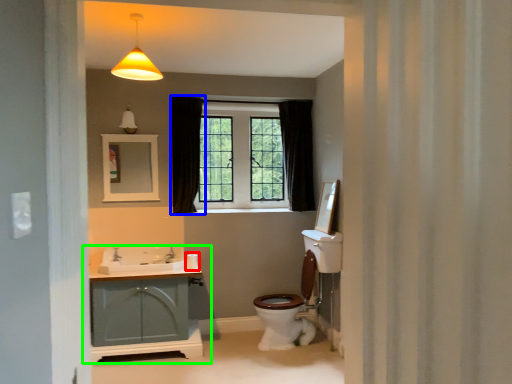
Question: Which object is the farthest from toilet paper (highlighted by a red box)? Choose among these: curtain (highlighted by a blue box) or bathroom cabinet (highlighted by a green box).

Choices:
 (A) curtain
 (B) bathroom cabinet

Answer: (A)